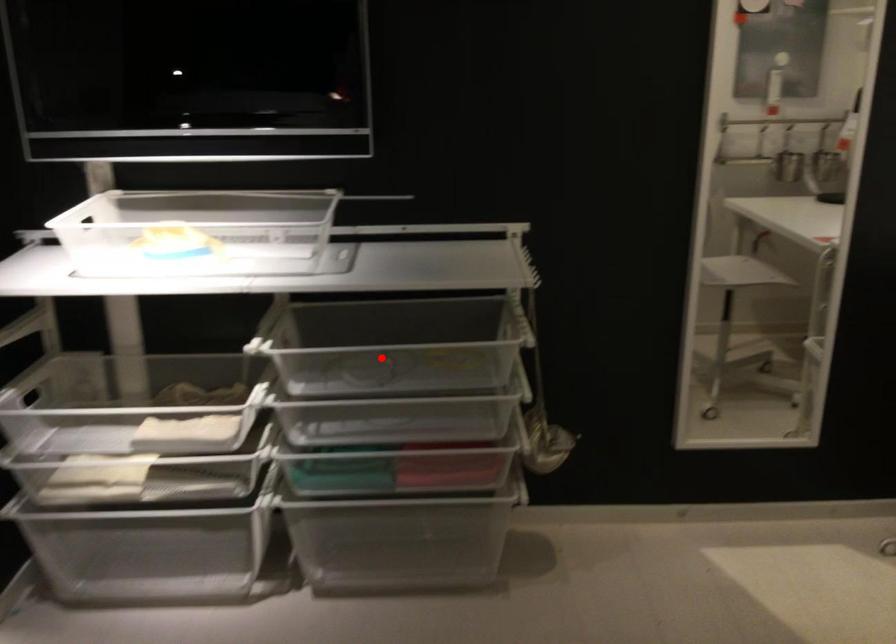
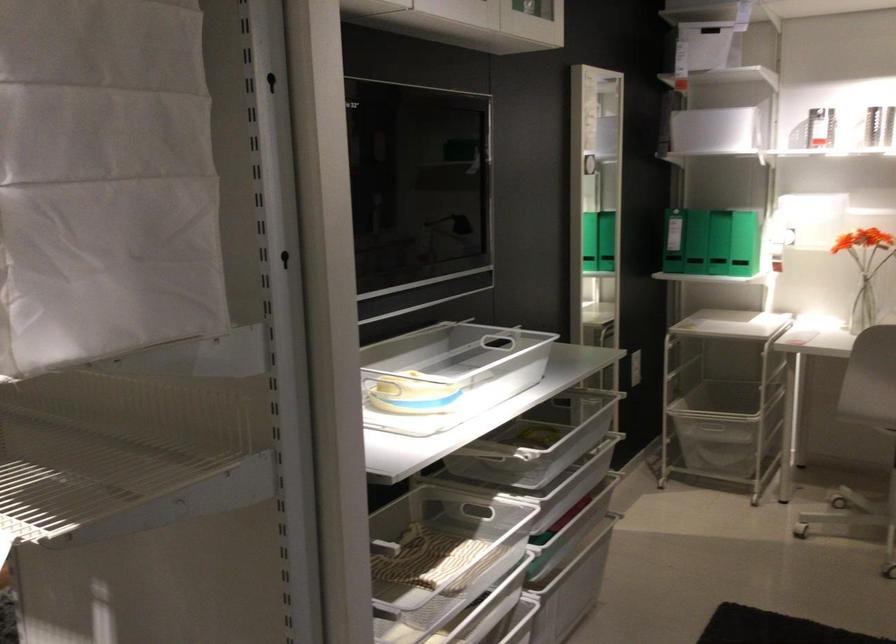
Question: I am providing you with two images of the same scene from different viewpoints. A red point is marked on the first image. Is the red point's position out of view in image 2?

Choices:
 (A) Yes
 (B) No

Answer: (A)